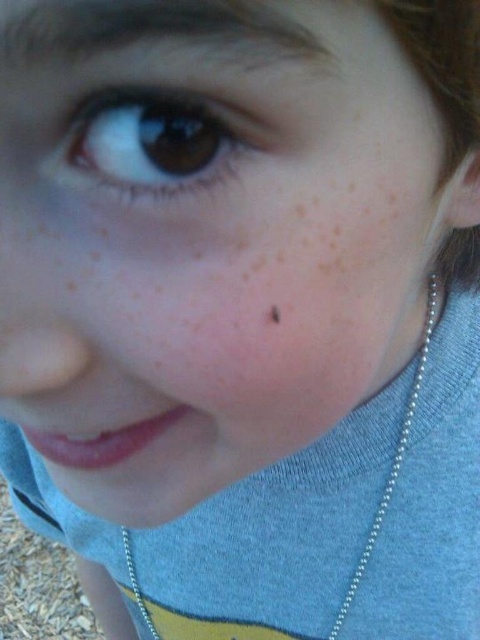
You are a photographer adjusting the focus on your camera. You want to ensure that both the silver chain at lower center and the brown matte freckle at center are in focus. Which object should you focus on first to achieve this?

You should focus on the brown matte freckle at center first because the silver chain at lower center is positioned under it, meaning they are at different depths. By focusing on the closer object, you can ensure the depth of field captures both.

You are a photographer adjusting the focus on your camera. You want to ensure both the brown matte eye at upper left and the silver chain at lower center are in focus. Based on their positions, which object should you focus on first to capture both clearly?

You should focus on the brown matte eye at upper left first because it is located above the silver chain at lower center, allowing the depth of field to cover both objects.

You are a makeup artist trying to apply a freckle makeup design on the cheek. You have a small brush that can only cover an area as big as the brown matte freckle at center. Can you use this brush to paint the area where the brown matte eye at upper left is located?

The brown matte eye at upper left is bigger than the brown matte freckle at center, so the brush may not be sufficient to cover the entire area of the brown matte eye at upper left since it is larger than the freckle.